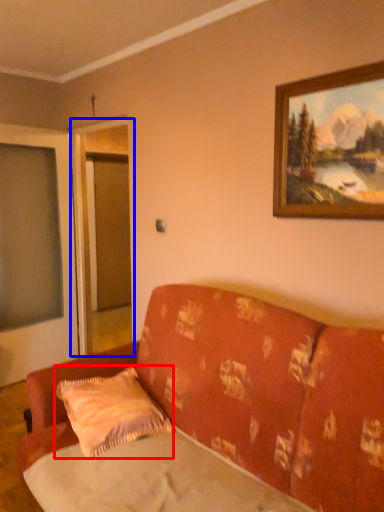
Question: Which object is closer to the camera taking this photo, pillow (highlighted by a red box) or screen door (highlighted by a blue box)?

Choices:
 (A) pillow
 (B) screen door

Answer: (A)